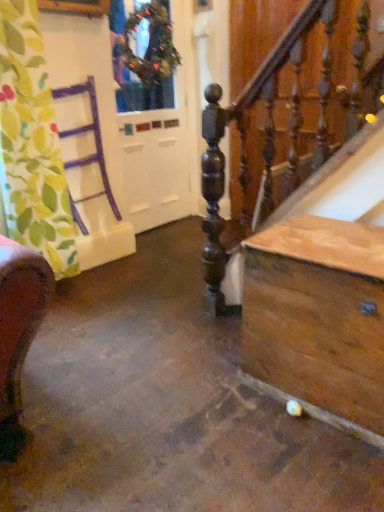
I want to click on blank space situated above wooden chest at lower right (from a real-world perspective), so click(x=336, y=243).